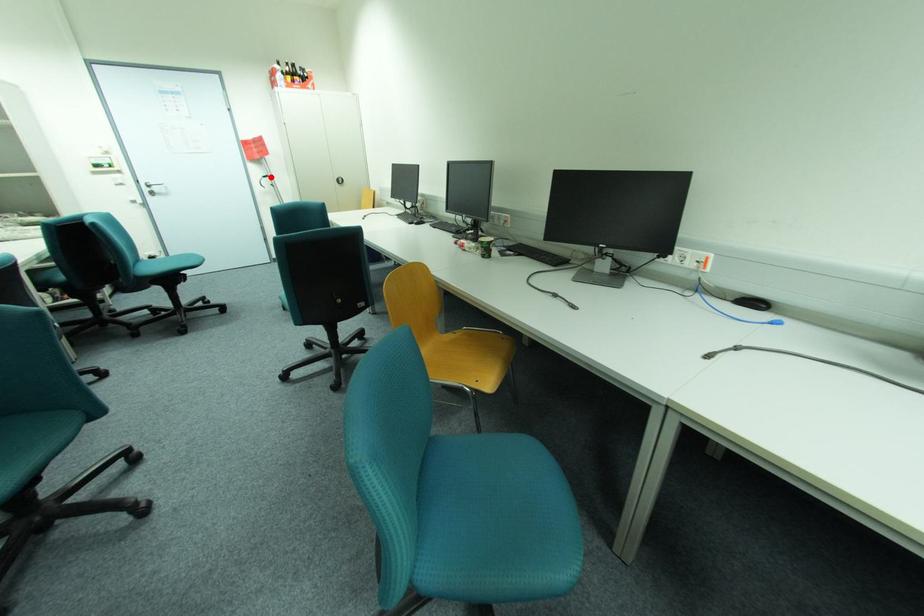
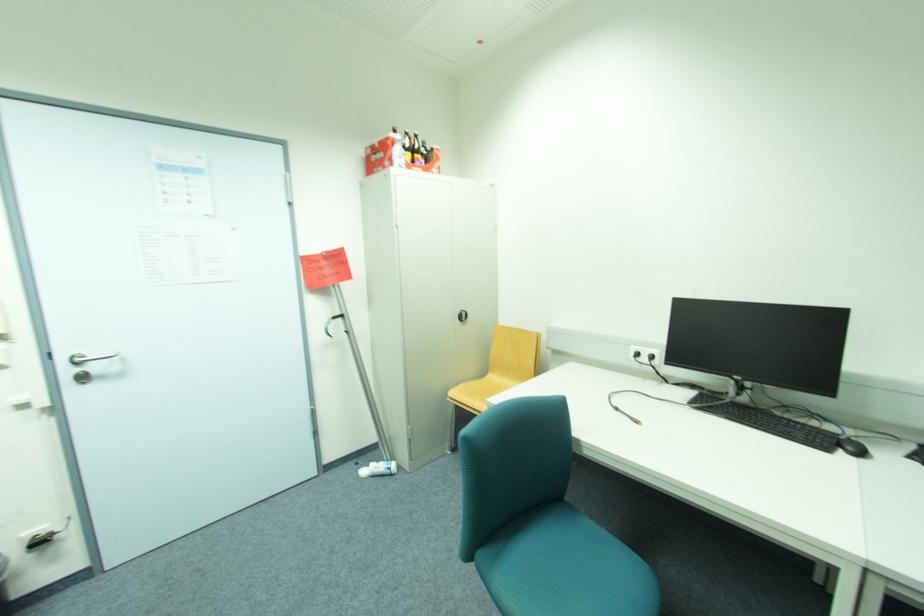
Question: I am providing you with two images of the same scene from different viewpoints. A red point is marked on the first image. At the location where the point appears in image 1, is it still visible in image 2?

Choices:
 (A) Yes
 (B) No

Answer: (A)